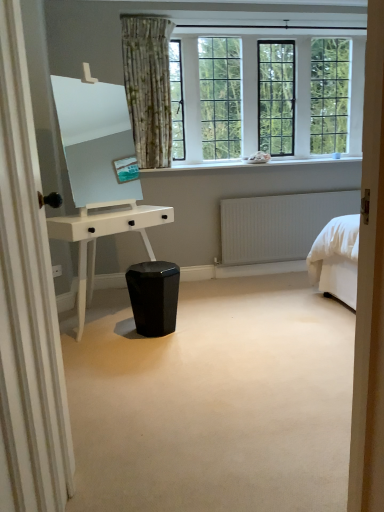
Question: Considering the positions of glossy black stool at center and white smooth window sill at upper center in the image, is glossy black stool at center bigger or smaller than white smooth window sill at upper center?

Choices:
 (A) small
 (B) big

Answer: (B)

Question: Considering the positions of glossy black stool at center and white smooth window sill at upper center in the image, is glossy black stool at center wider or thinner than white smooth window sill at upper center?

Choices:
 (A) thin
 (B) wide

Answer: (B)

Question: Based on their relative distances, which object is nearer to the white glossy desk at center?

Choices:
 (A) white matte radiator at right
 (B) floral fabric curtain at upper left
 (C) glossy black stool at center
 (D) white smooth window sill at upper center
 (E) clear glass windows at upper center

Answer: (C)

Question: Based on their relative distances, which object is nearer to the white glossy desk at center?

Choices:
 (A) white matte radiator at right
 (B) glossy black stool at center
 (C) clear glass windows at upper center
 (D) floral fabric curtain at upper left
 (E) white smooth window sill at upper center

Answer: (B)